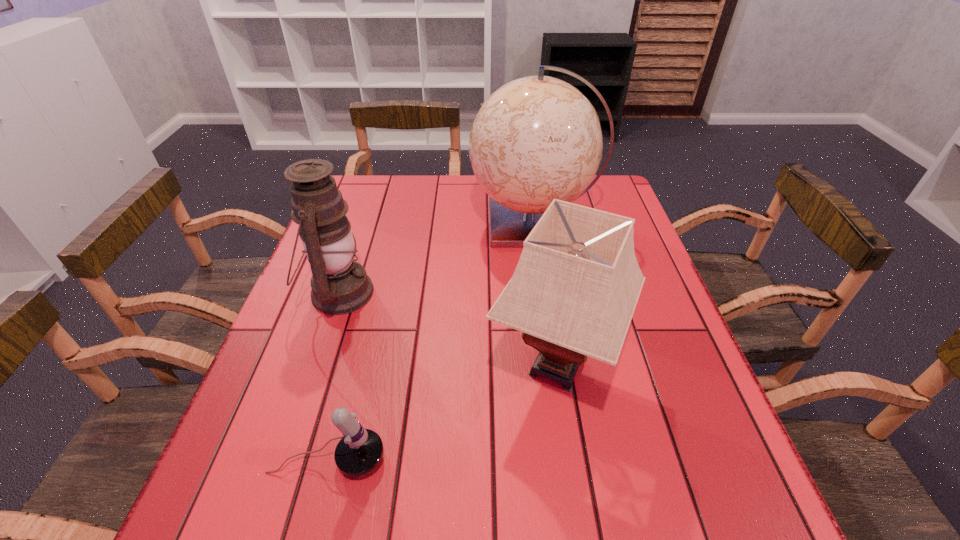
Identify the location of free point located on the right of the lampshade. (657, 367).

Locate an element on the screen. This screenshot has height=540, width=960. vacant space located on the right of the shortest object is located at coordinates (420, 459).

Where is `object located at the far edge`? This screenshot has width=960, height=540. object located at the far edge is located at coordinates (538, 138).

Identify the location of oil lamp that is at the left edge. This screenshot has width=960, height=540. (339, 285).

Where is `microphone at the left edge`? The width and height of the screenshot is (960, 540). microphone at the left edge is located at coordinates (360, 450).

Locate an element on the screen. This screenshot has width=960, height=540. globe located at the right edge is located at coordinates (538, 138).

Locate an element on the screen. The height and width of the screenshot is (540, 960). lampshade located at the right edge is located at coordinates (573, 293).

Where is `object that is at the far right corner`? The height and width of the screenshot is (540, 960). object that is at the far right corner is located at coordinates (538, 138).

Where is `vacant space at the left edge of the desktop`? vacant space at the left edge of the desktop is located at coordinates (288, 453).

The height and width of the screenshot is (540, 960). In the image, there is a desktop. In order to click on vacant area at the right edge in this screenshot , I will do `click(668, 326)`.